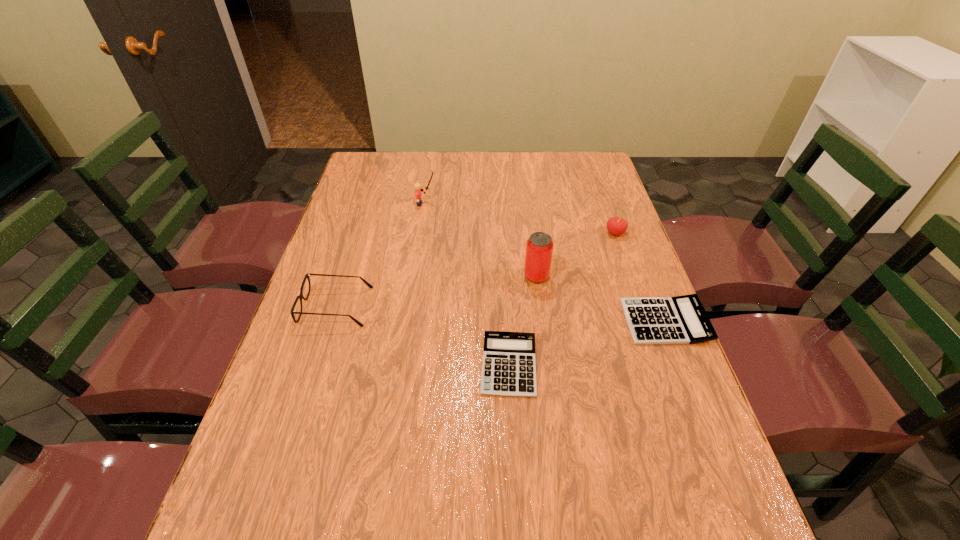
At what (x,y) coordinates should I click in order to perform the action: click on the shorter calculator. Please return your answer as a coordinate pair (x, y). Looking at the image, I should click on (509, 366).

Identify the location of the left calculator. The width and height of the screenshot is (960, 540). (509, 366).

I want to click on the fifth tallest object, so click(682, 319).

You are a GUI agent. You are given a task and a screenshot of the screen. Output one action in this format:
    pyautogui.click(x=<x>, y=<y>)
    Task: Click on the taller calculator
    The height and width of the screenshot is (540, 960).
    Given the screenshot: What is the action you would take?
    pyautogui.click(x=682, y=319)

What are the coordinates of `the third shortest object` in the screenshot? It's located at (307, 275).

Where is `the leftmost object`? The width and height of the screenshot is (960, 540). the leftmost object is located at coordinates (307, 275).

Identify the location of can. [539, 248].

Where is `the third farthest object`? The height and width of the screenshot is (540, 960). the third farthest object is located at coordinates (539, 248).

Identify the location of cherry. (615, 225).

Find the location of a particular element. This screenshot has height=540, width=960. the farthest object is located at coordinates (418, 190).